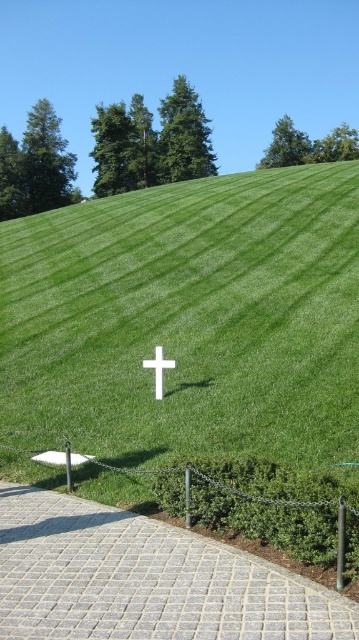
Does point (198, 612) come farther from viewer compared to point (154, 365)?

No.

Is point (165, 589) closer to viewer compared to point (166, 369)?

Yes, point (165, 589) is closer to viewer.

Image resolution: width=359 pixels, height=640 pixels. I want to click on gray cobblestone path at lower center, so click(145, 579).